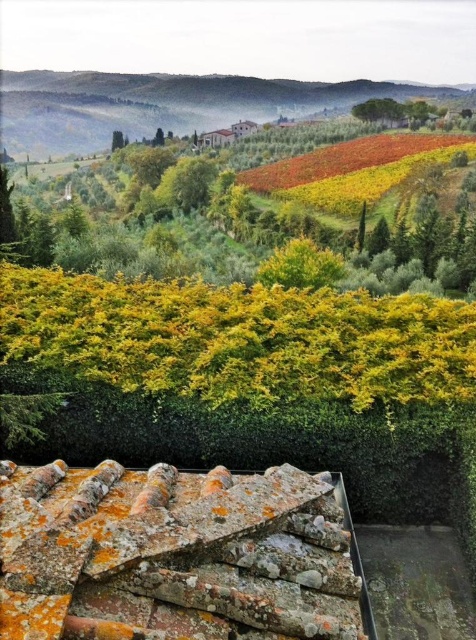
Between rusty terracotta tiles at center and green grassy hillside at upper center, which one appears on the left side from the viewer's perspective?

green grassy hillside at upper center is more to the left.

Is point (52, 465) behind point (21, 145)?

That is False.

Locate an element on the screen. rusty terracotta tiles at center is located at coordinates (174, 554).

Between green grassy hillside at upper center and green leafy tree at center, which one is positioned higher?

green grassy hillside at upper center is above.

Between green grassy hillside at upper center and green leafy tree at center, which one appears on the right side from the viewer's perspective?

green grassy hillside at upper center is more to the right.

Is point (307, 84) more distant than point (120, 140)?

Yes, point (307, 84) is farther from viewer.

Locate an element on the screen. The image size is (476, 640). green grassy hillside at upper center is located at coordinates (167, 104).

Who is more distant from viewer, (x=73, y=486) or (x=120, y=147)?

Point (x=120, y=147)

Can you confirm if rusty terracotta tiles at center is thinner than green leafy tree at center?

Yes.

Who is more forward, (214, 577) or (124, 145)?

Point (214, 577) is in front.

Image resolution: width=476 pixels, height=640 pixels. Find the location of `rusty terracotta tiles at center`. rusty terracotta tiles at center is located at coordinates (174, 554).